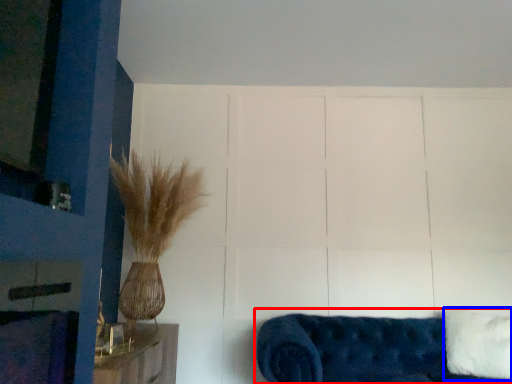
Question: Which point is further to the camera, studio couch (highlighted by a red box) or pillow (highlighted by a blue box)?

Choices:
 (A) studio couch
 (B) pillow

Answer: (B)